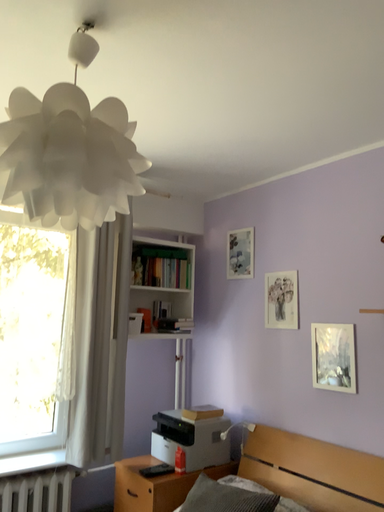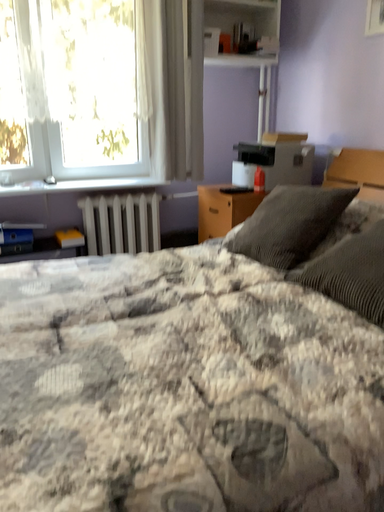
Question: Which way did the camera rotate in the video?

Choices:
 (A) rotated upward
 (B) rotated downward

Answer: (B)